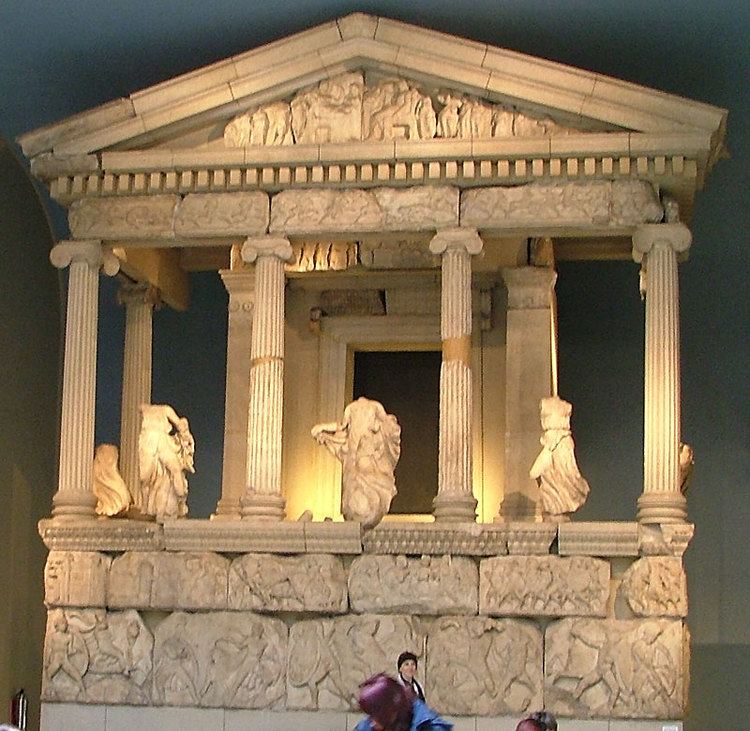
Find the location of a particular element. Image resolution: width=750 pixels, height=731 pixels. right of doorway is located at coordinates (438, 352), (436, 401), (436, 444), (432, 499).